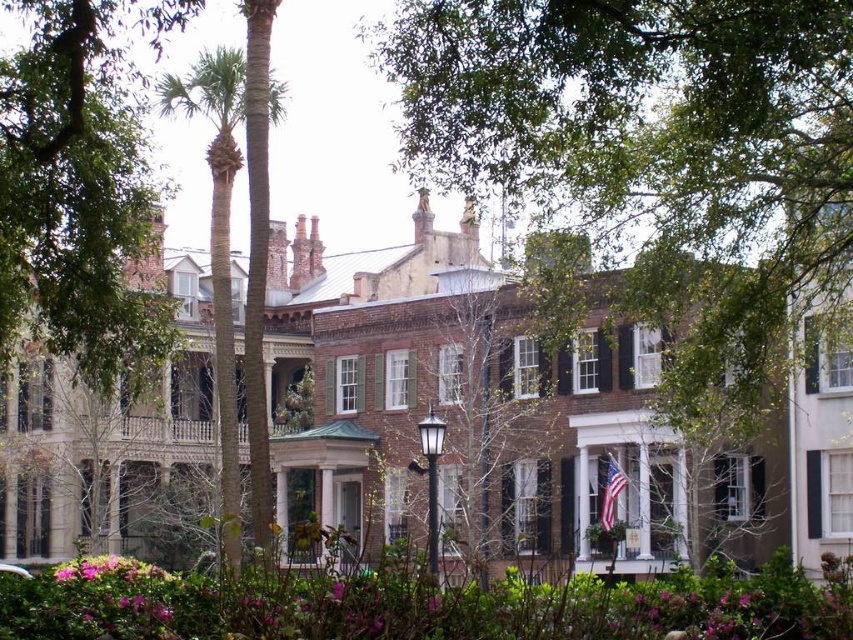
Is brown brick mansion at center to the left of green leafy palm tree at center from the viewer's perspective?

Incorrect, brown brick mansion at center is not on the left side of green leafy palm tree at center.

Is brown brick mansion at center further to camera compared to green leafy palm tree at center?

No, it is not.

At what (x,y) coordinates should I click in order to perform the action: click on brown brick mansion at center. Please return your answer as a coordinate pair (x, y). Looking at the image, I should click on (518, 422).

Who is lower down, green leafy tree at upper center or green leafy palm tree at center?

Positioned lower is green leafy palm tree at center.

Does point (677, 369) come behind point (235, 493)?

No.

The height and width of the screenshot is (640, 853). Find the location of `green leafy tree at upper center`. green leafy tree at upper center is located at coordinates (654, 156).

The width and height of the screenshot is (853, 640). What do you see at coordinates (654, 156) in the screenshot? I see `green leafy tree at upper center` at bounding box center [654, 156].

Between green leafy tree at upper center and green leafy tree at upper left, which one appears on the right side from the viewer's perspective?

green leafy tree at upper center

Is point (759, 300) positioned in front of point (33, 108)?

No, (759, 300) is behind (33, 108).

I want to click on green leafy tree at upper center, so click(x=654, y=156).